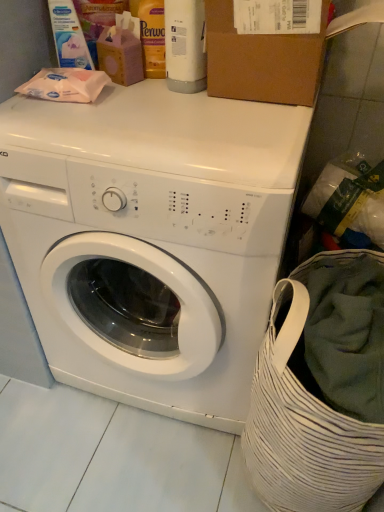
I want to click on free location to the right of matte white wipes at upper left, which is counted as the second cleaning product, starting from the right, so click(x=152, y=91).